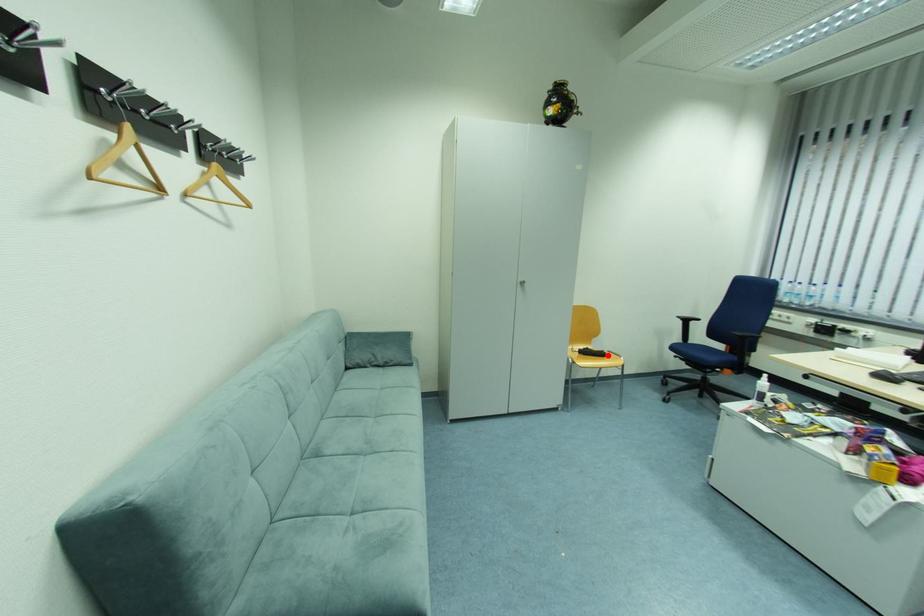
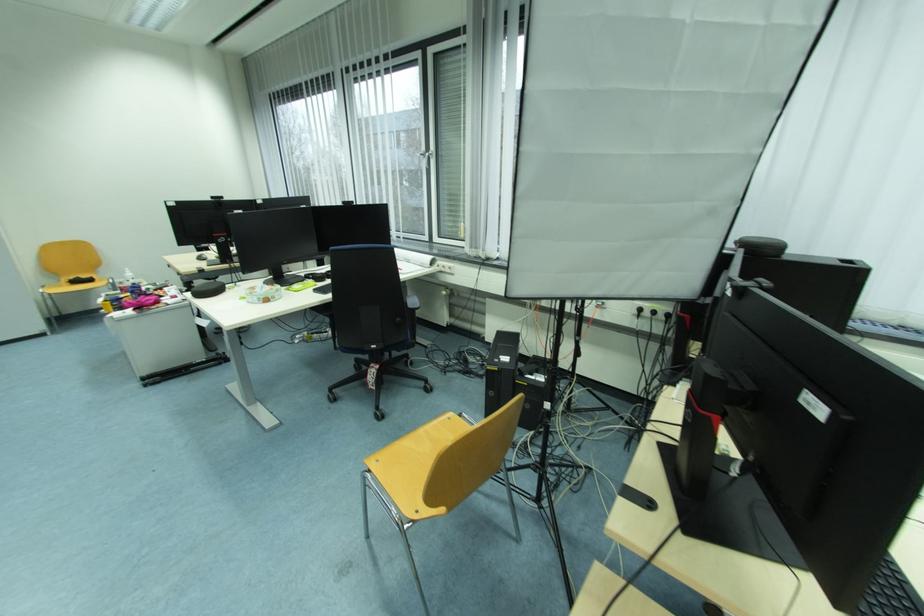
In the second image, find the point that corresponds to the highlighted location in the first image.

(96, 282)